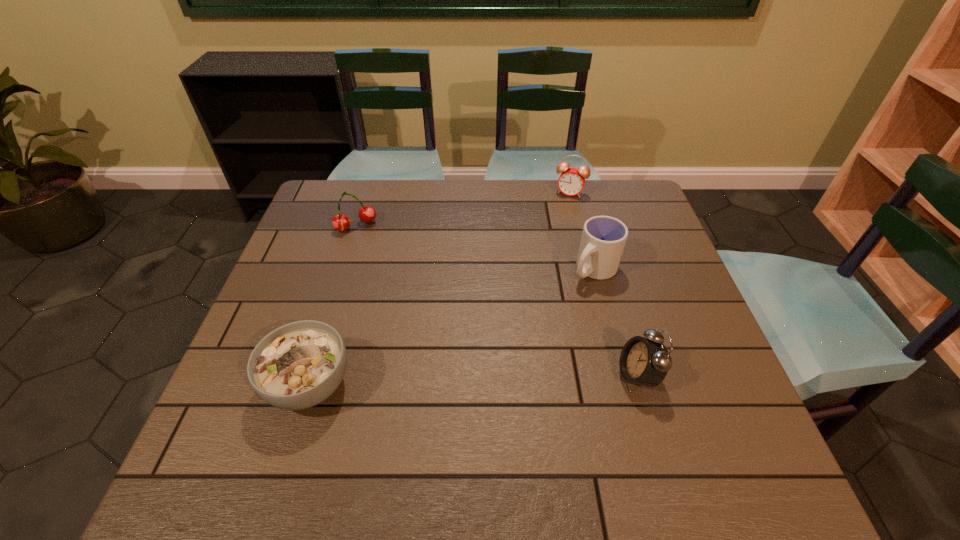
This screenshot has height=540, width=960. Find the location of `the shortest object`. the shortest object is located at coordinates (298, 365).

The image size is (960, 540). Find the location of `the nearer alarm clock`. the nearer alarm clock is located at coordinates (643, 361).

Identify the location of the third nearest object. 603,239.

Where is `the farthest object`? the farthest object is located at coordinates (571, 181).

At what (x,y) coordinates should I click in order to perform the action: click on the fourth nearest object. Please return your answer as a coordinate pair (x, y). Looking at the image, I should click on (340, 222).

I want to click on free space located on the back of the shortest object, so click(x=335, y=302).

Find the location of a particular element. Image resolution: width=960 pixels, height=540 pixels. vacant space located on the face of the nearer alarm clock is located at coordinates (433, 376).

Locate an element on the screen. This screenshot has width=960, height=540. vacant space located on the face of the nearer alarm clock is located at coordinates (586, 376).

Locate an element on the screen. free region located 0.230m on the face of the nearer alarm clock is located at coordinates (512, 376).

The width and height of the screenshot is (960, 540). I want to click on vacant space situated with the handle on the side of the cup, so click(517, 333).